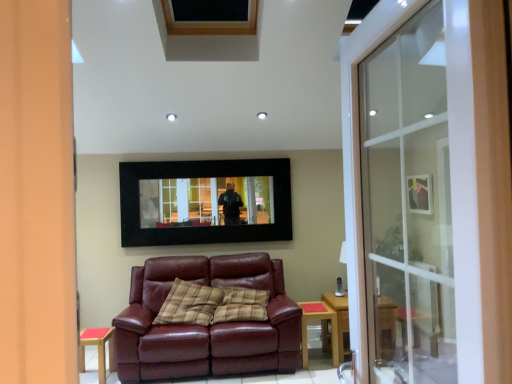
Locate an element on the screen. This screenshot has height=384, width=512. matte black picture frame at upper right, which is counted as the 1th picture frame, starting from the right is located at coordinates (420, 194).

What do you see at coordinates (420, 194) in the screenshot?
I see `matte black picture frame at upper right, acting as the second picture frame starting from the left` at bounding box center [420, 194].

What is the approximate width of wooden side table at lower left?

The width of wooden side table at lower left is 32.96 centimeters.

What do you see at coordinates (205, 202) in the screenshot? The height and width of the screenshot is (384, 512). I see `black matte picture frame at center, which appears as the second picture frame when viewed from the right` at bounding box center [205, 202].

Locate an element on the screen. This screenshot has width=512, height=384. matte black picture frame at upper right, which is counted as the 1th picture frame, starting from the right is located at coordinates (420, 194).

Is point (226, 275) closer or farther from the camera than point (423, 271)?

Clearly, point (226, 275) is more distant from the camera than point (423, 271).

From a real-world perspective, is matte leather couch at center physically above transparent glass screen door at right?

Actually, matte leather couch at center is physically below transparent glass screen door at right in the real world.

Considering their positions, is matte leather couch at center located in front of or behind transparent glass screen door at right?

matte leather couch at center is positioned farther from the viewer than transparent glass screen door at right.

Is light brown wooden side table at lower center oriented towards wooden side table at lower left?

No.

Is point (320, 305) more distant than point (79, 362)?

Yes, it is.

Is light brown wooden side table at lower center closer to camera compared to wooden side table at lower left?

No, the depth of light brown wooden side table at lower center is greater than that of wooden side table at lower left.

Is light brown wooden side table at lower center placed right next to wooden side table at lower left?

light brown wooden side table at lower center and wooden side table at lower left are not in contact.

How distant is matte black picture frame at upper right, acting as the second picture frame starting from the left, from transparent glass screen door at right?

A distance of 7.80 inches exists between matte black picture frame at upper right, acting as the second picture frame starting from the left, and transparent glass screen door at right.

Between matte black picture frame at upper right, acting as the second picture frame starting from the left, and transparent glass screen door at right, which one appears on the left side from the viewer's perspective?

transparent glass screen door at right.

Which is closer to the camera, (418,194) or (391,219)?

Point (418,194) is closer to the camera than point (391,219).

Is matte black picture frame at upper right, which is counted as the 1th picture frame, starting from the right, surrounding transparent glass screen door at right?

That's incorrect, transparent glass screen door at right is not inside matte black picture frame at upper right, which is counted as the 1th picture frame, starting from the right.

From the image's perspective, is transparent glass screen door at right beneath plaid fabric pillow at center?

No, from the image's perspective, transparent glass screen door at right is not beneath plaid fabric pillow at center.

This screenshot has height=384, width=512. Find the location of `pillow below the transparent glass screen door at right (from a real-world perspective)`. pillow below the transparent glass screen door at right (from a real-world perspective) is located at coordinates (189, 304).

Is transparent glass screen door at right taller than plaid fabric pillow at center?

Correct, transparent glass screen door at right is much taller as plaid fabric pillow at center.

Does transparent glass screen door at right touch plaid fabric pillow at center?

transparent glass screen door at right and plaid fabric pillow at center are clearly separated.

Is transparent glass screen door at right far away from light brown wooden side table at lower center?

That's right, there is a large distance between transparent glass screen door at right and light brown wooden side table at lower center.

How distant is transparent glass screen door at right from light brown wooden side table at lower center?

4.42 feet.

Is transparent glass screen door at right smaller than light brown wooden side table at lower center?

Incorrect, transparent glass screen door at right is not smaller in size than light brown wooden side table at lower center.

Based on the photo, is transparent glass screen door at right in front of or behind light brown wooden side table at lower center in the image?

Visually, transparent glass screen door at right is located in front of light brown wooden side table at lower center.

Does matte black picture frame at upper right, which is counted as the 1th picture frame, starting from the right, appear on the right side of wooden side table at lower left?

Correct, you'll find matte black picture frame at upper right, which is counted as the 1th picture frame, starting from the right, to the right of wooden side table at lower left.

How distant is matte black picture frame at upper right, which is counted as the 1th picture frame, starting from the right, from wooden side table at lower left?

matte black picture frame at upper right, which is counted as the 1th picture frame, starting from the right, and wooden side table at lower left are 3.24 meters apart from each other.

Which of these two, matte black picture frame at upper right, which is counted as the 1th picture frame, starting from the right, or wooden side table at lower left, is wider?

wooden side table at lower left.

Is the surface of black matte picture frame at center, the first picture frame when ordered from left to right, in direct contact with matte leather couch at center?

They are not placed beside each other.

Is black matte picture frame at center, the first picture frame when ordered from left to right, wider than matte leather couch at center?

No.

In the scene shown: Between black matte picture frame at center, the first picture frame when ordered from left to right, and matte leather couch at center, which one has more height?

Standing taller between the two is matte leather couch at center.

Between black matte picture frame at center, which appears as the second picture frame when viewed from the right, and matte leather couch at center, which one is positioned in front?

matte leather couch at center.

The width and height of the screenshot is (512, 384). In order to click on screen door on the right of matte leather couch at center in this screenshot , I will do 441,197.

Where is `table above the wooden side table at lower left (from the image's perspective)`? This screenshot has height=384, width=512. table above the wooden side table at lower left (from the image's perspective) is located at coordinates (320, 319).

When comparing their distances from light brown wooden side table at lower center, does transparent glass screen door at right or plaid fabric pillow at center seem further?

transparent glass screen door at right is positioned further to the anchor light brown wooden side table at lower center.

Considering their positions, is matte black picture frame at upper right, which is counted as the 1th picture frame, starting from the right, positioned further to transparent glass screen door at right than black matte picture frame at center, the first picture frame when ordered from left to right?

black matte picture frame at center, the first picture frame when ordered from left to right.

Estimate the real-world distances between objects in this image. Which object is closer to matte black picture frame at upper right, which is counted as the 1th picture frame, starting from the right, light brown wooden side table at lower center or matte leather couch at center?

light brown wooden side table at lower center lies closer to matte black picture frame at upper right, which is counted as the 1th picture frame, starting from the right, than the other object.

From the image, which object appears to be farther from black matte picture frame at center, the first picture frame when ordered from left to right, matte black picture frame at upper right, acting as the second picture frame starting from the left, or transparent glass screen door at right?

Based on the image, matte black picture frame at upper right, acting as the second picture frame starting from the left, appears to be further to black matte picture frame at center, the first picture frame when ordered from left to right.

Looking at the image, which one is located further to black matte picture frame at center, the first picture frame when ordered from left to right, transparent glass screen door at right or plaid fabric pillow at center?

transparent glass screen door at right is positioned further to the anchor black matte picture frame at center, the first picture frame when ordered from left to right.

Estimate the real-world distances between objects in this image. Which object is further from black matte picture frame at center, the first picture frame when ordered from left to right, light brown wooden side table at lower center or wooden side table at lower left?

wooden side table at lower left is further to black matte picture frame at center, the first picture frame when ordered from left to right.

When comparing their distances from wooden side table at lower left, does plaid fabric pillow at center or matte leather couch at center seem closer?

The object closer to wooden side table at lower left is plaid fabric pillow at center.

Considering their positions, is light brown wooden side table at lower center positioned closer to wooden side table at lower left than matte leather couch at center?

matte leather couch at center.

In order to click on pillow situated between wooden side table at lower left and light brown wooden side table at lower center from left to right in this screenshot , I will do `click(189, 304)`.

I want to click on table between transparent glass screen door at right and black matte picture frame at center, the first picture frame when ordered from left to right, along the z-axis, so coord(320,319).

Identify the location of pillow between transparent glass screen door at right and black matte picture frame at center, which appears as the second picture frame when viewed from the right, in the front-back direction. (189, 304).

Where is `picture frame located between plaid fabric pillow at center and matte black picture frame at upper right, acting as the second picture frame starting from the left, in the left-right direction`? Image resolution: width=512 pixels, height=384 pixels. picture frame located between plaid fabric pillow at center and matte black picture frame at upper right, acting as the second picture frame starting from the left, in the left-right direction is located at coordinates (205, 202).